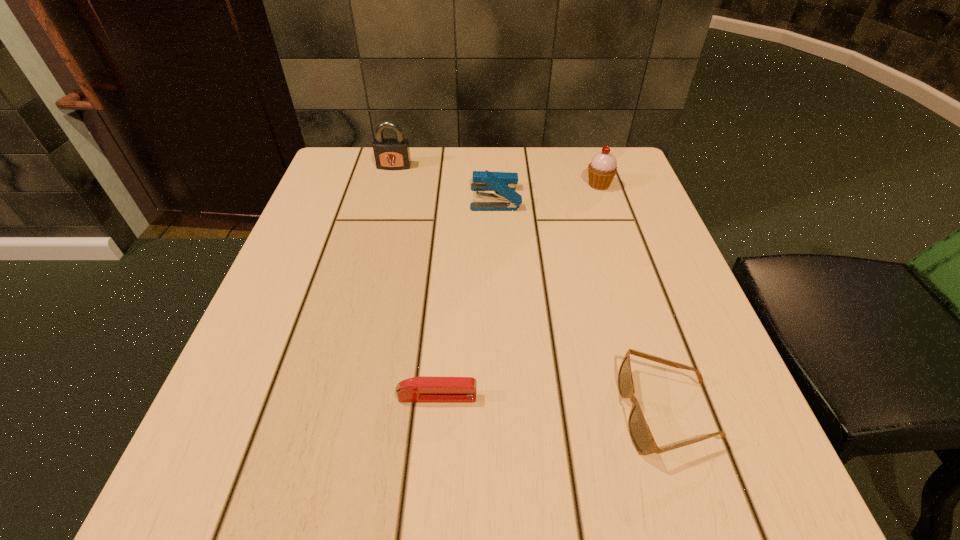
Identify the location of the farthest object. The image size is (960, 540). (390, 153).

Image resolution: width=960 pixels, height=540 pixels. I want to click on padlock, so click(390, 153).

At what (x,y) coordinates should I click in order to perform the action: click on cupcake. Please return your answer as a coordinate pair (x, y). Looking at the image, I should click on (603, 167).

Identify the location of the taller stapler. Image resolution: width=960 pixels, height=540 pixels. (502, 183).

Image resolution: width=960 pixels, height=540 pixels. I want to click on the fourth tallest object, so [x=640, y=434].

Find the location of a particular element. This screenshot has height=540, width=960. the nearer stapler is located at coordinates (422, 389).

Find the location of a particular element. This screenshot has width=960, height=540. the shorter stapler is located at coordinates (422, 389).

You are a GUI agent. You are given a task and a screenshot of the screen. Output one action in this format:
    pyautogui.click(x=<x>, y=<y>)
    Task: Click on the blank space located 0.130m on the front of the padlock near the keyhole
    Image resolution: width=960 pixels, height=540 pixels.
    Given the screenshot: What is the action you would take?
    pyautogui.click(x=385, y=202)

What are the coordinates of `vacant space located on the left of the cupcake` in the screenshot? It's located at (435, 185).

Where is `vacant space situated on the left of the farther stapler`? vacant space situated on the left of the farther stapler is located at coordinates (431, 198).